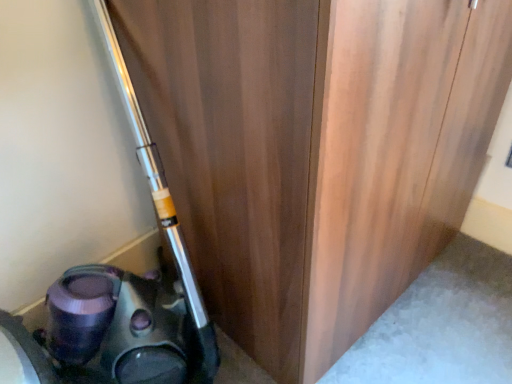
Describe the element at coordinates (123, 296) in the screenshot. I see `matte black vacuum cleaner at lower left` at that location.

In order to click on matte black vacuum cleaner at lower left in this screenshot , I will do `click(123, 296)`.

Locate an element on the screen. matte black vacuum cleaner at lower left is located at coordinates (123, 296).